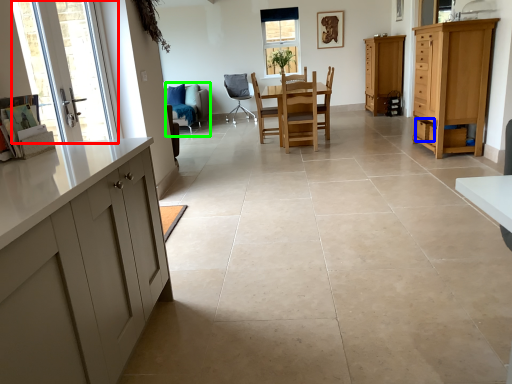
Question: Which object is positioned closest to glass door (highlighted by a red box)? Select from drawer (highlighted by a blue box) and chair (highlighted by a green box).

Choices:
 (A) drawer
 (B) chair

Answer: (B)